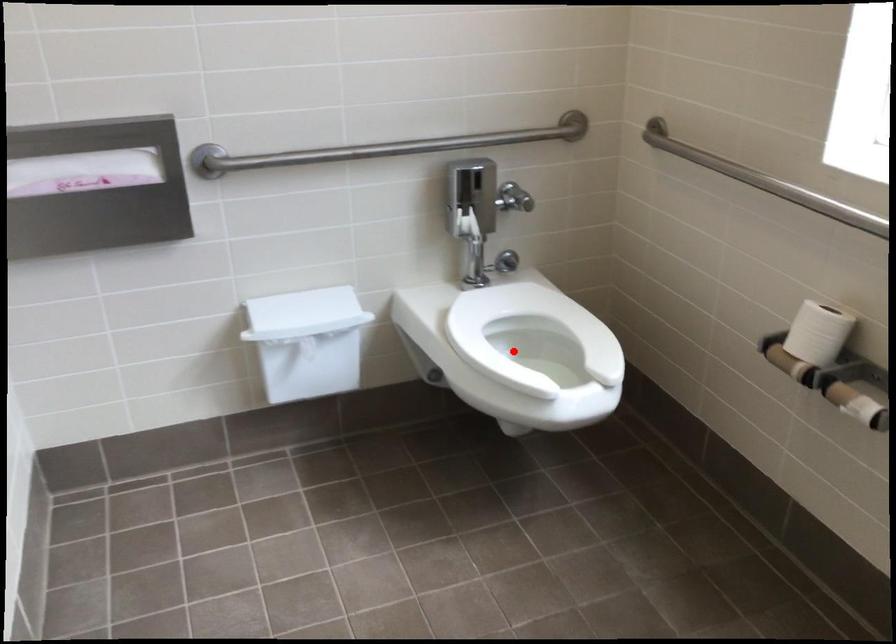
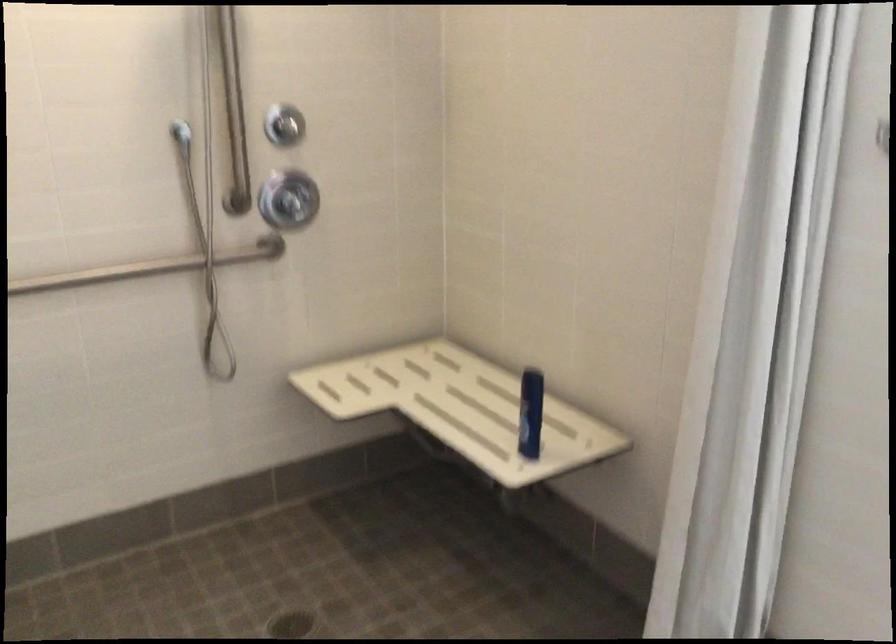
Question: I am providing you with two images of the same scene from different viewpoints. A red point is marked on the first image. At the location where the point appears in image 1, is it still visible in image 2?

Choices:
 (A) Yes
 (B) No

Answer: (B)